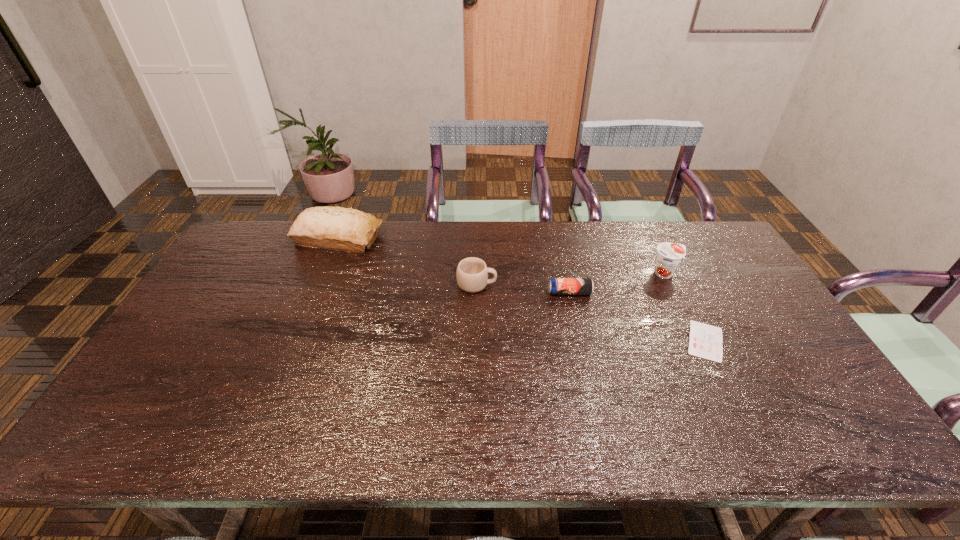
This screenshot has height=540, width=960. Find the location of `object that is the closest one to the mug`. object that is the closest one to the mug is located at coordinates click(557, 286).

Where is `object that can be found as the fourth closest to the yogurt`? This screenshot has width=960, height=540. object that can be found as the fourth closest to the yogurt is located at coordinates (335, 228).

Find the location of `vacant point that satisfies the following two spatial constraints: 1. on the front side of the second tallest object; 2. on the side of the third shortest object with the handle`. vacant point that satisfies the following two spatial constraints: 1. on the front side of the second tallest object; 2. on the side of the third shortest object with the handle is located at coordinates (671, 285).

Where is `vacant region that satisfies the following two spatial constraints: 1. on the side of the fourth tallest object with the handle; 2. on the right side of the mug`? Image resolution: width=960 pixels, height=540 pixels. vacant region that satisfies the following two spatial constraints: 1. on the side of the fourth tallest object with the handle; 2. on the right side of the mug is located at coordinates (477, 293).

In order to click on free space that satisfies the following two spatial constraints: 1. on the front side of the second tallest object; 2. on the side of the third shortest object with the handle in this screenshot , I will do point(671,285).

You are a GUI agent. You are given a task and a screenshot of the screen. Output one action in this format:
    pyautogui.click(x=<x>, y=<y>)
    Task: Click on the blank space that satisfies the following two spatial constraints: 1. on the side of the second object from left to right with the handle; 2. on the left side of the third object from left to right
    
    Given the screenshot: What is the action you would take?
    pyautogui.click(x=477, y=293)

I want to click on vacant point that satisfies the following two spatial constraints: 1. on the front side of the yogurt; 2. on the side of the fourth object from right to left with the handle, so click(671, 285).

Identify the location of vacant position in the image that satisfies the following two spatial constraints: 1. on the back side of the nearest object; 2. on the side of the second object from left to right with the handle. (677, 285).

Where is `free location that satisfies the following two spatial constraints: 1. on the front side of the yogurt; 2. on the side of the third tallest object with the handle`? This screenshot has width=960, height=540. free location that satisfies the following two spatial constraints: 1. on the front side of the yogurt; 2. on the side of the third tallest object with the handle is located at coordinates (671, 285).

Where is `vacant region that satisfies the following two spatial constraints: 1. on the side of the mug with the handle; 2. on the right side of the beer can`? The width and height of the screenshot is (960, 540). vacant region that satisfies the following two spatial constraints: 1. on the side of the mug with the handle; 2. on the right side of the beer can is located at coordinates (477, 293).